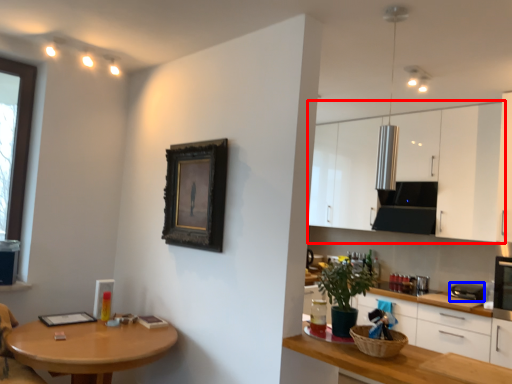
Question: Which object appears farthest to the camera in this image, cabinetry (highlighted by a red box) or appliance (highlighted by a blue box)?

Choices:
 (A) cabinetry
 (B) appliance

Answer: (A)